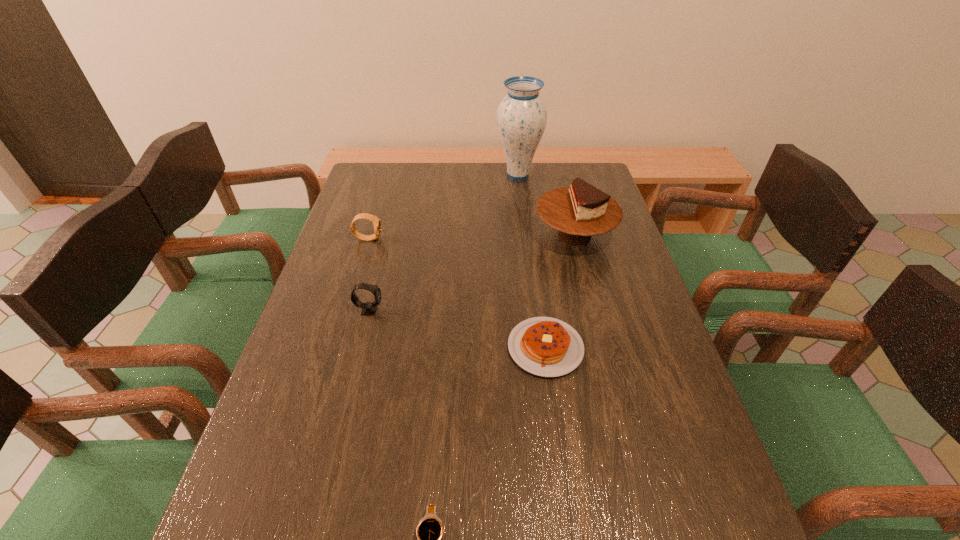
The width and height of the screenshot is (960, 540). What are the coordinates of `vase` in the screenshot? It's located at point(521,117).

At what (x,y) coordinates should I click in order to perform the action: click on the tallest object. Please return your answer as a coordinate pair (x, y). The height and width of the screenshot is (540, 960). Looking at the image, I should click on (521, 117).

The width and height of the screenshot is (960, 540). Identify the location of cake. (580, 211).

This screenshot has height=540, width=960. In order to click on the third nearest object in this screenshot , I will do `click(369, 308)`.

At what (x,y) coordinates should I click in order to perform the action: click on the farthest watch. Please return your answer as a coordinate pair (x, y). Image resolution: width=960 pixels, height=540 pixels. Looking at the image, I should click on (375, 220).

Identify the location of pancake. (544, 346).

Image resolution: width=960 pixels, height=540 pixels. In order to click on the second nearest object in this screenshot , I will do `click(544, 346)`.

This screenshot has width=960, height=540. Identify the location of vacant region located 0.120m on the right of the vase. (573, 175).

Find the location of a particular element. The image size is (960, 540). free space located 0.220m on the left of the second tallest object is located at coordinates (463, 235).

This screenshot has height=540, width=960. In order to click on vacant space situated 0.390m on the face of the fourth farthest object in this screenshot , I will do `click(534, 310)`.